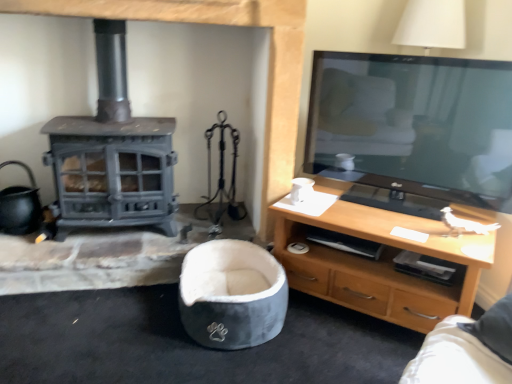
This screenshot has height=384, width=512. I want to click on vacant region above light wood/finish tv stand at right (from a real-world perspective), so coord(399,206).